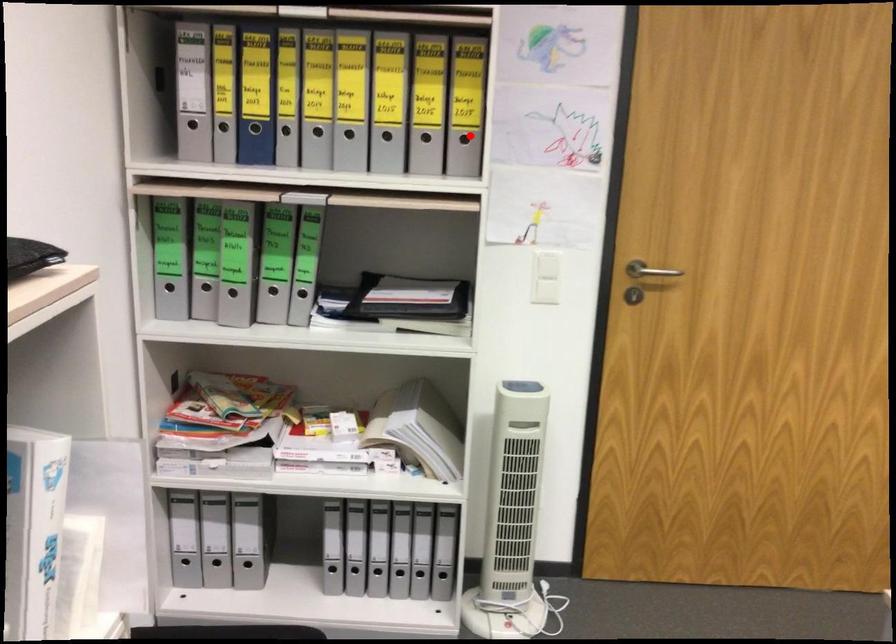
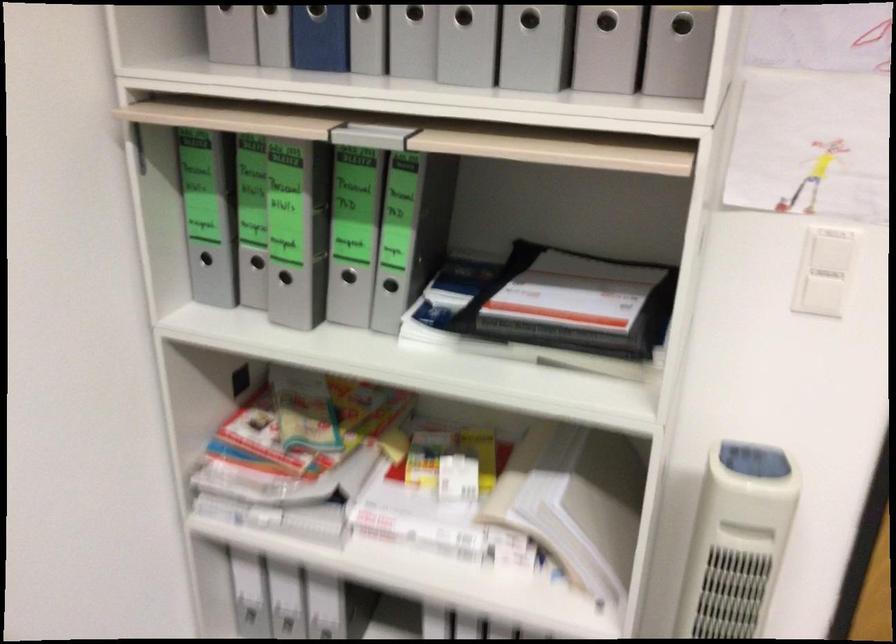
Question: I am providing you with two images of the same scene from different viewpoints. A red point is shown in image1. For the corresponding object point in image2, is it positioned nearer or farther from the camera?

Choices:
 (A) Nearer
 (B) Farther

Answer: (A)